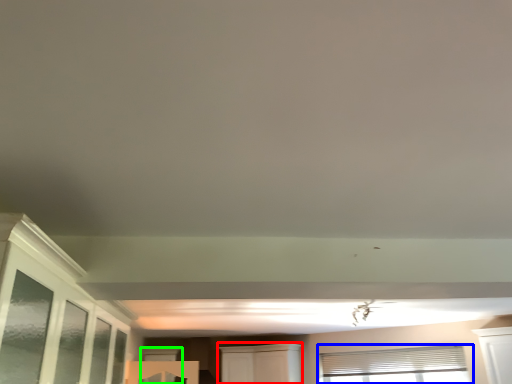
Question: Which object is the farthest from cabinetry (highlighted by a red box)? Choose among these: window (highlighted by a blue box) or window (highlighted by a green box).

Choices:
 (A) window
 (B) window

Answer: (B)